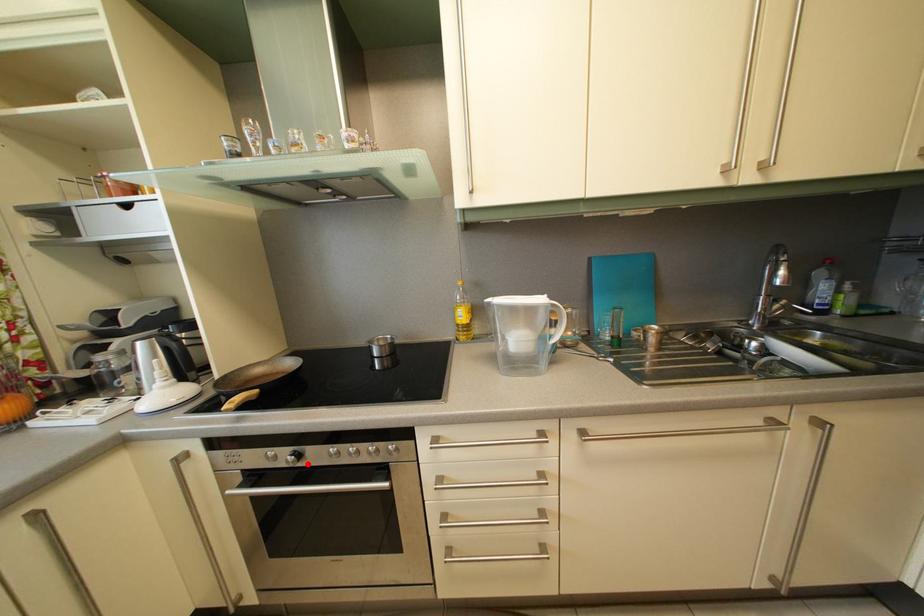
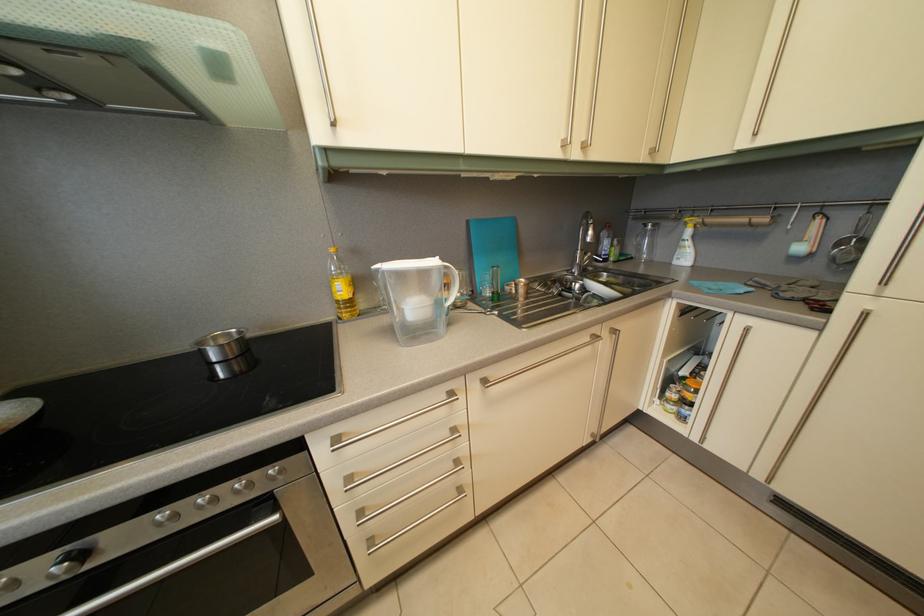
Find the pixel in the second image that matches the highlighted location in the first image.

(92, 562)